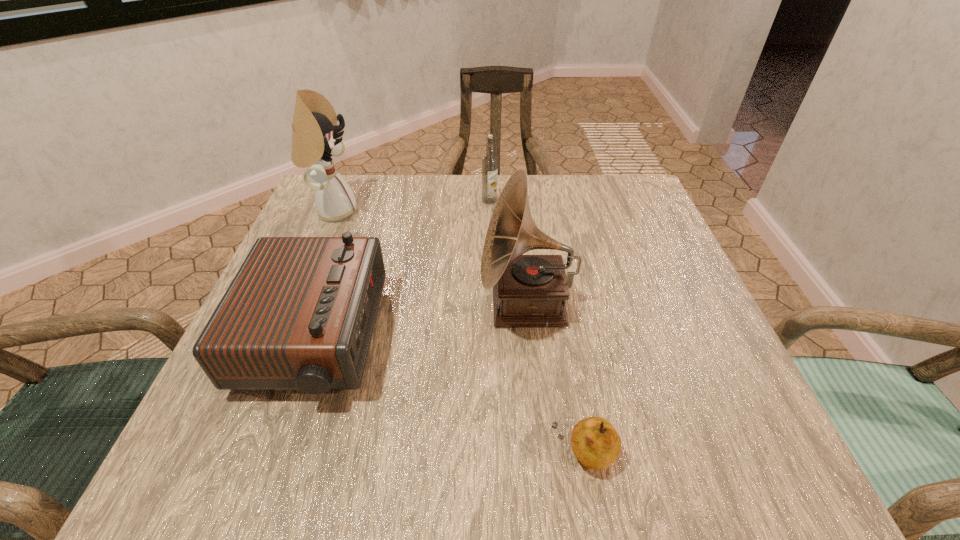
The height and width of the screenshot is (540, 960). In order to click on vacant space located 0.230m on the label of the third shortest object in this screenshot , I will do `click(492, 268)`.

Where is `vacant space positioned on the tuning display of the fourth tallest object`? This screenshot has height=540, width=960. vacant space positioned on the tuning display of the fourth tallest object is located at coordinates (549, 340).

Image resolution: width=960 pixels, height=540 pixels. I want to click on vacant space located on the back of the pear, so click(550, 264).

Where is `doll at the far edge`? doll at the far edge is located at coordinates (314, 140).

Image resolution: width=960 pixels, height=540 pixels. Find the location of `vodka at the far edge`. vodka at the far edge is located at coordinates (489, 162).

Image resolution: width=960 pixels, height=540 pixels. I want to click on object positioned at the near edge, so click(x=596, y=444).

Where is `doll that is at the left edge`? The image size is (960, 540). doll that is at the left edge is located at coordinates (314, 140).

Identify the location of radio receiver that is at the left edge. The width and height of the screenshot is (960, 540). (299, 314).

This screenshot has height=540, width=960. I want to click on object situated at the far left corner, so click(314, 140).

Where is `free region at the far edge`? This screenshot has width=960, height=540. free region at the far edge is located at coordinates click(439, 228).